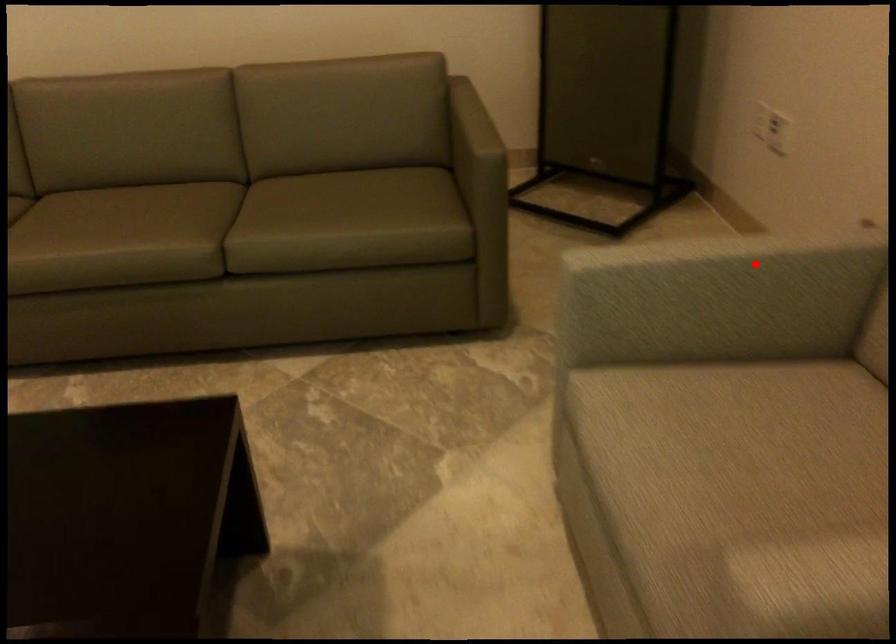
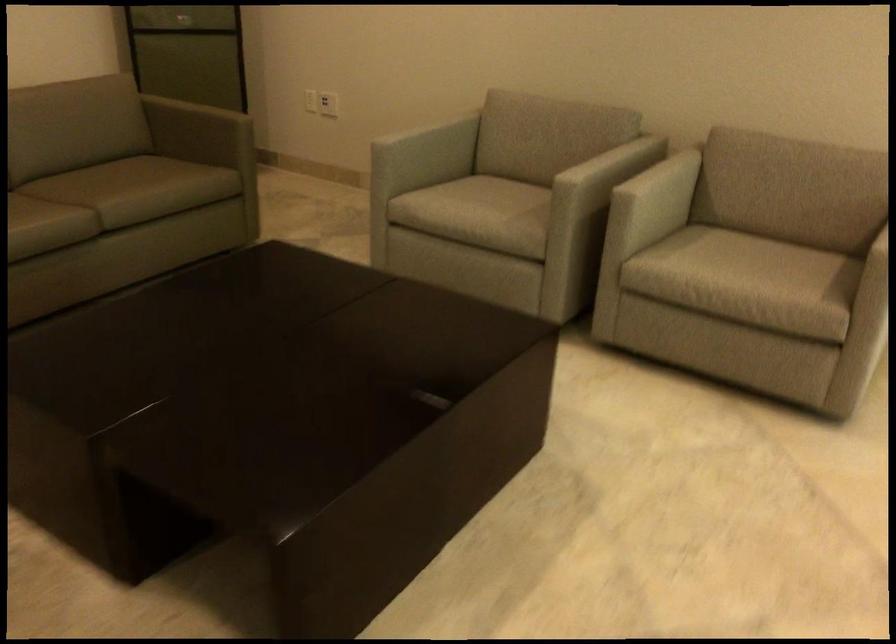
Find the pixel in the second image that matches the highlighted location in the first image.

(423, 127)